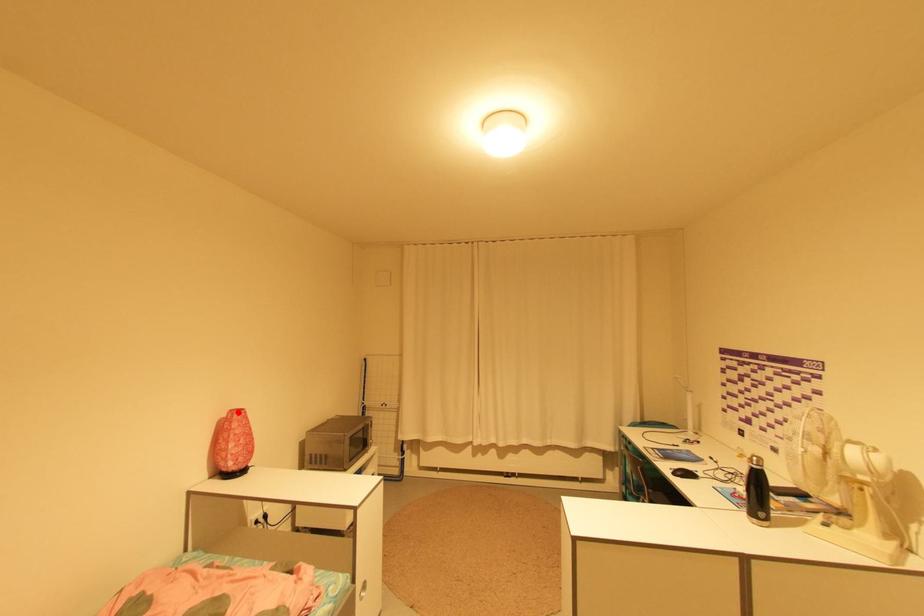
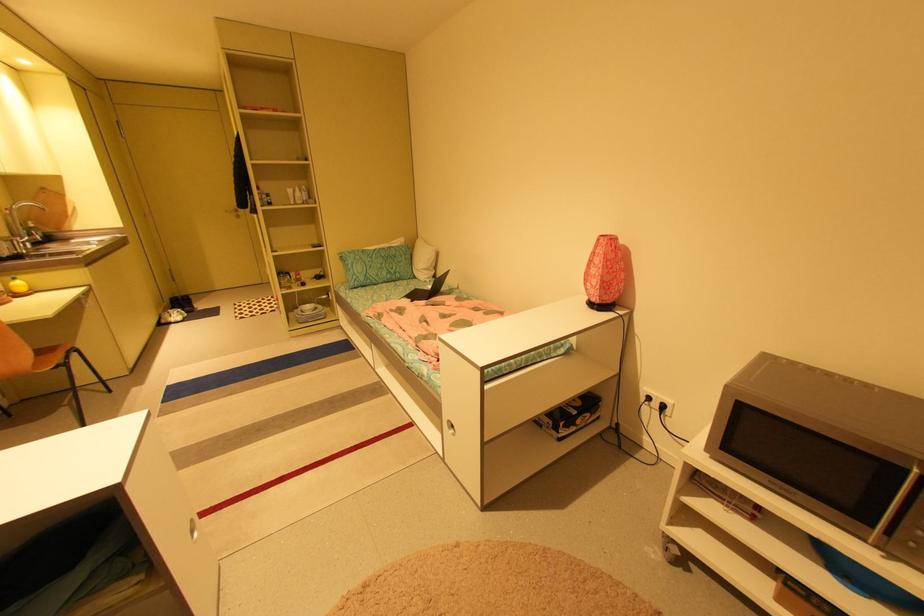
Locate, in the second image, the point that corresponds to the highlighted location in the first image.

(608, 236)